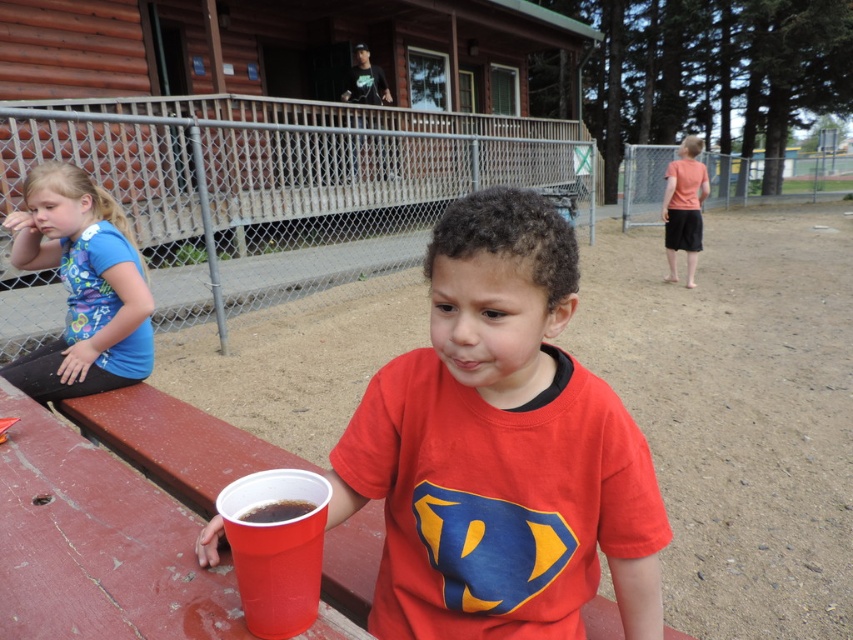
Between shiny plastic cup at lower left and matte pink shirt at right, which one appears on the left side from the viewer's perspective?

Positioned to the left is shiny plastic cup at lower left.

Does shiny plastic cup at lower left appear over matte pink shirt at right?

Actually, shiny plastic cup at lower left is below matte pink shirt at right.

The width and height of the screenshot is (853, 640). I want to click on shiny plastic cup at lower left, so click(276, 548).

Locate an element on the screen. This screenshot has height=640, width=853. shiny plastic cup at lower left is located at coordinates (276, 548).

Is blue cotton shirt at left positioned at the back of shiny plastic cup at lower left?

Yes.

Does point (129, 321) come behind point (247, 611)?

Yes, it is behind point (247, 611).

The width and height of the screenshot is (853, 640). I want to click on blue cotton shirt at left, so click(80, 285).

Is blue cotton shirt at left wider than matte pink shirt at right?

Yes, blue cotton shirt at left is wider than matte pink shirt at right.

Who is higher up, blue cotton shirt at left or matte pink shirt at right?

matte pink shirt at right is above.

Find the location of a particular element. This screenshot has height=640, width=853. blue cotton shirt at left is located at coordinates (80, 285).